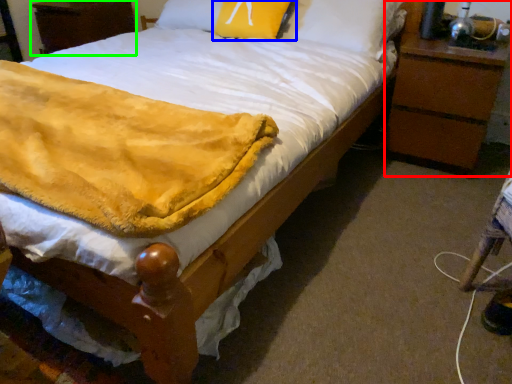
Question: Based on their relative distances, which object is nearer to nightstand (highlighted by a red box)? Choose from pillow (highlighted by a blue box) and nightstand (highlighted by a green box).

Choices:
 (A) pillow
 (B) nightstand

Answer: (A)